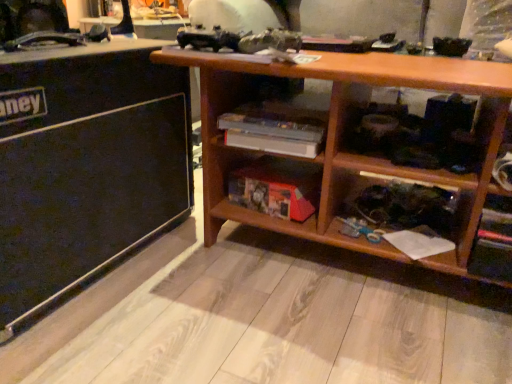
Question: From a real-world perspective, is black matte speaker at left positioned above or below wooden shelf at center?

Choices:
 (A) above
 (B) below

Answer: (B)

Question: Looking at the image, does black matte speaker at left seem bigger or smaller compared to wooden shelf at center?

Choices:
 (A) big
 (B) small

Answer: (A)

Question: Which is farther from the black matte speaker at left?

Choices:
 (A) wooden bookshelf at lower center
 (B) wooden shelf at center

Answer: (A)

Question: Estimate the real-world distances between objects in this image. Which object is closer to the black matte speaker at left?

Choices:
 (A) wooden bookshelf at lower center
 (B) wooden shelf at center

Answer: (B)